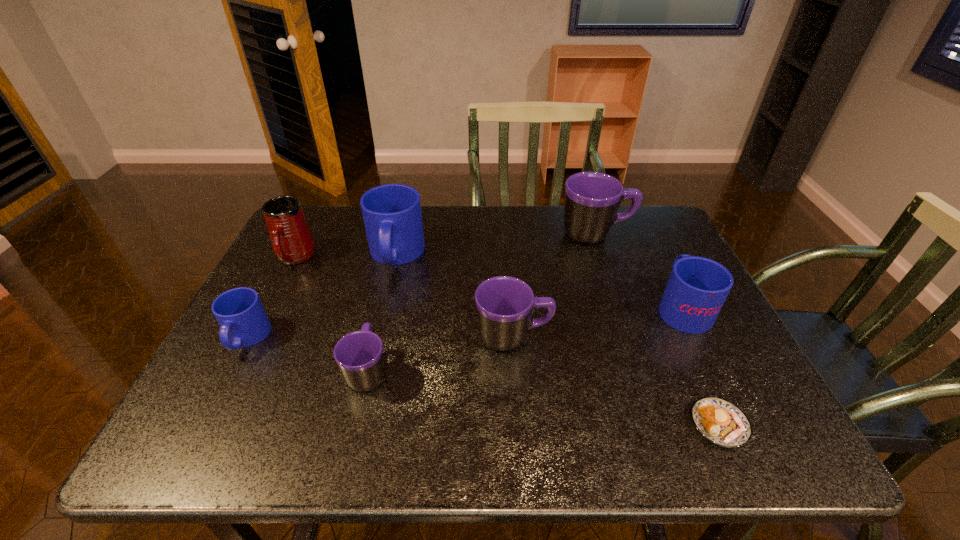
This screenshot has height=540, width=960. What are the coordinates of `the farthest blue mug` in the screenshot? It's located at (392, 215).

This screenshot has width=960, height=540. I want to click on the biggest blue mug, so click(392, 215).

The height and width of the screenshot is (540, 960). What are the coordinates of `the biggest black mug` in the screenshot? It's located at (592, 199).

Where is `the rightmost black mug`? the rightmost black mug is located at coordinates (592, 199).

Locate an element on the screen. red mug is located at coordinates (292, 241).

Find the location of `the rightmost blue mug`. the rightmost blue mug is located at coordinates (697, 288).

Find the location of a particular element. This screenshot has width=960, height=540. the fifth mug from left to right is located at coordinates [505, 305].

Locate an element on the screen. The width and height of the screenshot is (960, 540). the fifth object from left to right is located at coordinates (505, 305).

Identify the location of the smallest blue mug. The width and height of the screenshot is (960, 540). (243, 322).

At what (x,y) coordinates should I click in order to perform the action: click on the smallest black mug. Please return your answer as a coordinate pair (x, y). Looking at the image, I should click on (359, 354).